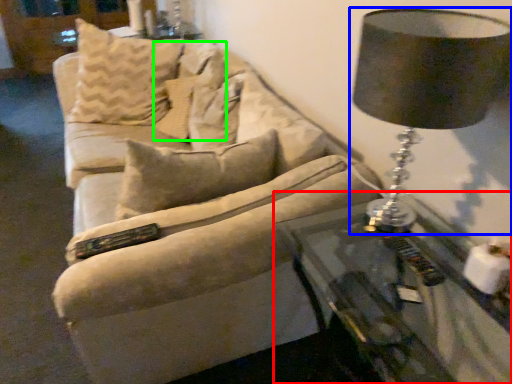
Question: Estimate the real-world distances between objects in this image. Which object is closer to table (highlighted by a red box), lamp (highlighted by a blue box) or pillow (highlighted by a green box)?

Choices:
 (A) lamp
 (B) pillow

Answer: (A)